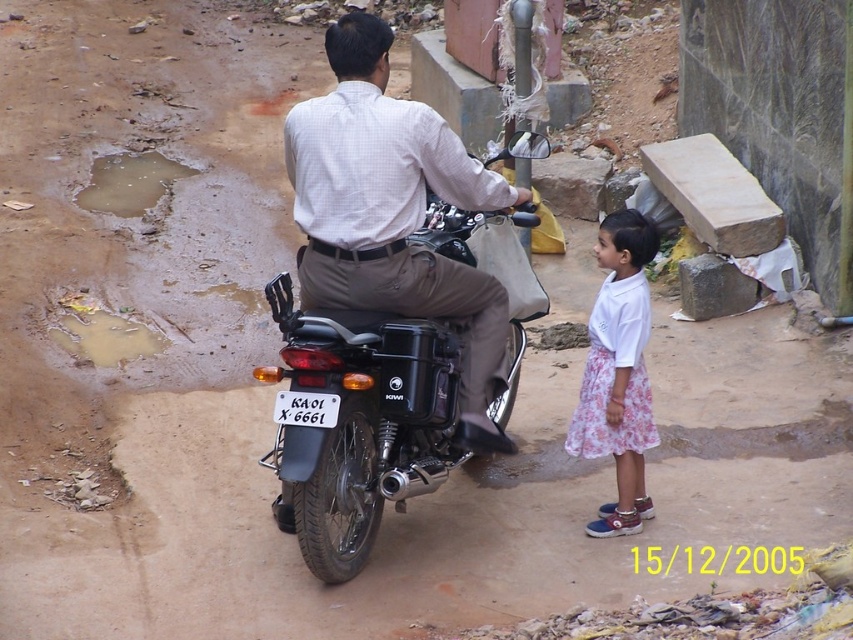
Question: Which point is closer to the camera?

Choices:
 (A) (610, 268)
 (B) (456, 381)
 (C) (322, 417)
 (D) (334, 49)

Answer: (C)

Question: Can you confirm if black matte motorcycle at center is positioned to the right of white plastic license plate at center?

Choices:
 (A) yes
 (B) no

Answer: (A)

Question: Estimate the real-world distances between objects in this image. Which object is closer to the white plastic license plate at center?

Choices:
 (A) white checkered shirt at center
 (B) black matte motorcycle at center

Answer: (B)

Question: Does white floral skirt at lower right appear over white plastic license plate at center?

Choices:
 (A) no
 (B) yes

Answer: (B)

Question: Is black matte motorcycle at center to the left of white checkered shirt at center from the viewer's perspective?

Choices:
 (A) yes
 (B) no

Answer: (A)

Question: Among these objects, which one is farthest from the camera?

Choices:
 (A) white plastic license plate at center
 (B) white checkered shirt at center
 (C) white floral skirt at lower right
 (D) black matte motorcycle at center

Answer: (C)